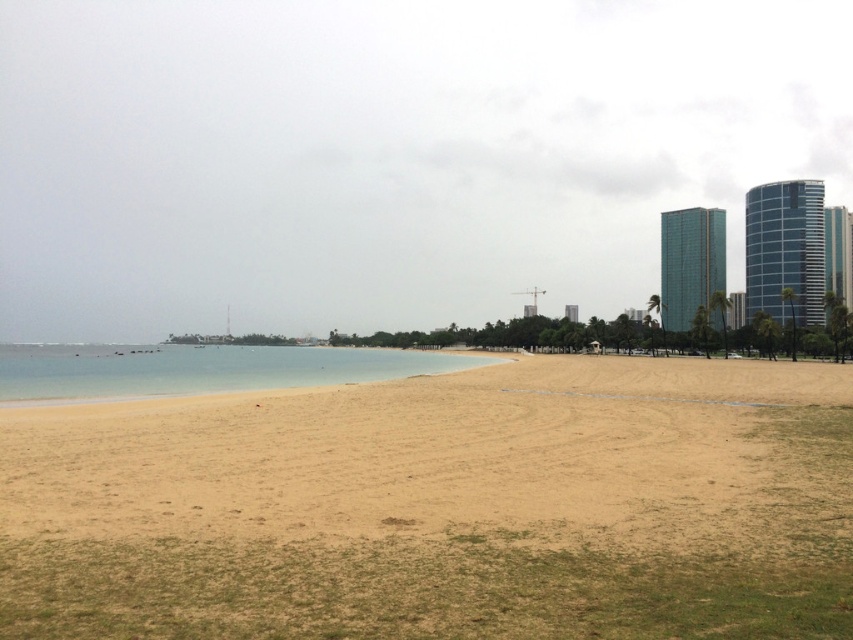
Question: Which point appears closest to the camera in this image?

Choices:
 (A) (711, 396)
 (B) (247, 384)

Answer: (A)

Question: Is smooth sand beach at center to the right of clear water at beach left from the viewer's perspective?

Choices:
 (A) yes
 (B) no

Answer: (A)

Question: Can you confirm if smooth sand beach at center is thinner than clear water at beach left?

Choices:
 (A) no
 (B) yes

Answer: (B)

Question: From the image, what is the correct spatial relationship of smooth sand beach at center in relation to clear water at beach left?

Choices:
 (A) below
 (B) above

Answer: (B)

Question: Among these objects, which one is farthest from the camera?

Choices:
 (A) smooth sand beach at center
 (B) clear water at beach left

Answer: (B)

Question: Which point is closer to the camera?

Choices:
 (A) clear water at beach left
 (B) smooth sand beach at center

Answer: (B)